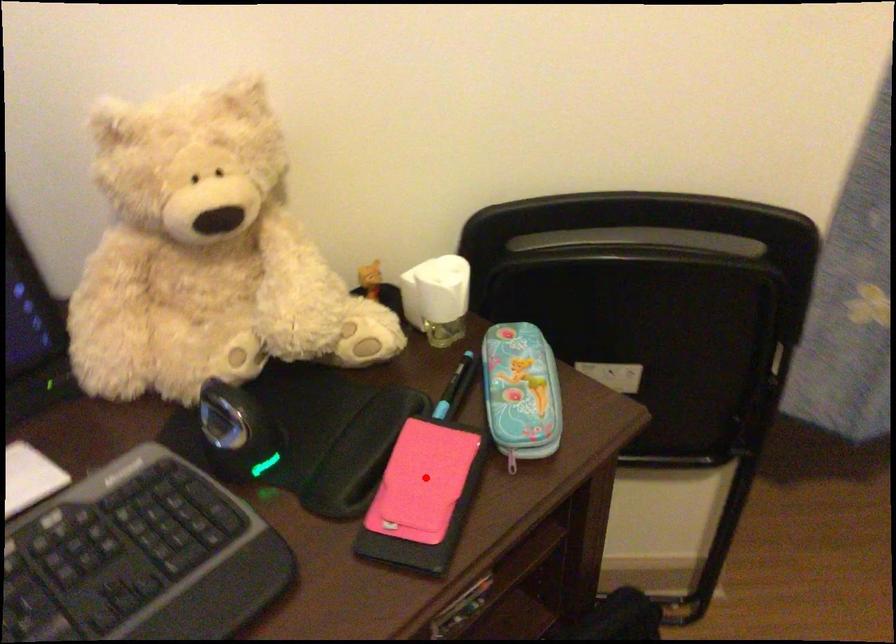
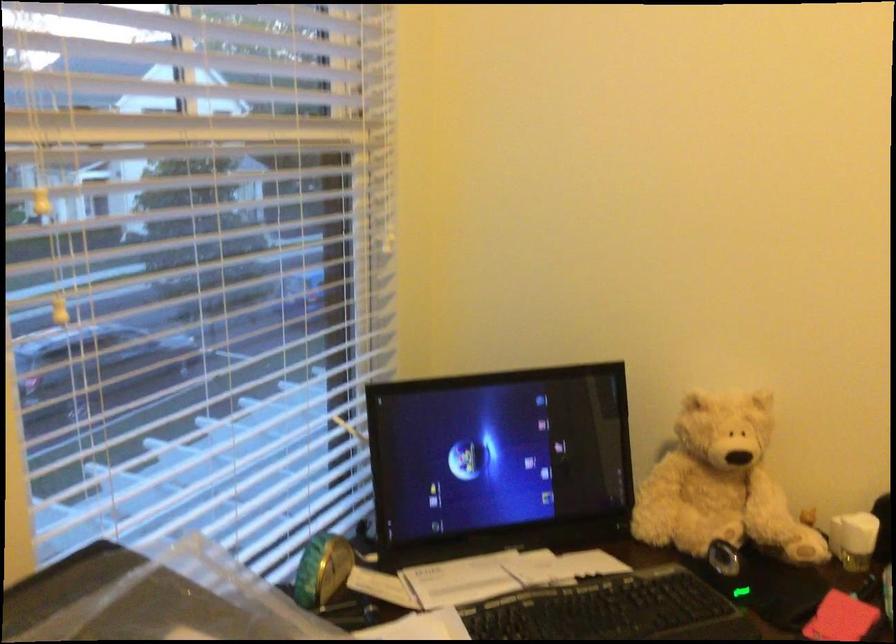
Find the pixel in the second image that matches the highlighted location in the first image.

(840, 618)